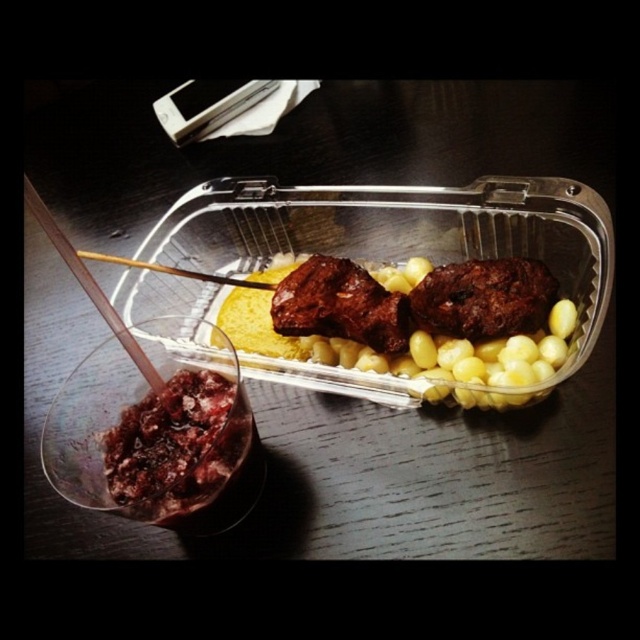
Can you confirm if brown matte meatballs at center is thinner than wooden chopstick at left?

No, brown matte meatballs at center is not thinner than wooden chopstick at left.

Is brown matte meatballs at center above wooden chopstick at left?

Incorrect, brown matte meatballs at center is not positioned above wooden chopstick at left.

Where is `brown matte meatballs at center`? This screenshot has width=640, height=640. brown matte meatballs at center is located at coordinates (397, 358).

Who is higher up, shiny dark red jam at lower left or wooden chopstick at center?

wooden chopstick at center is above.

Does shiny dark red jam at lower left have a greater height compared to wooden chopstick at center?

Yes.

Where is `shiny dark red jam at lower left`? This screenshot has width=640, height=640. shiny dark red jam at lower left is located at coordinates (177, 445).

Can you confirm if brown matte meatballs at center is smaller than shiny dark red jam at lower left?

Incorrect, brown matte meatballs at center is not smaller in size than shiny dark red jam at lower left.

Which is more to the right, brown matte meatballs at center or shiny dark red jam at lower left?

brown matte meatballs at center is more to the right.

Locate an element on the screen. brown matte meatballs at center is located at coordinates (397, 358).